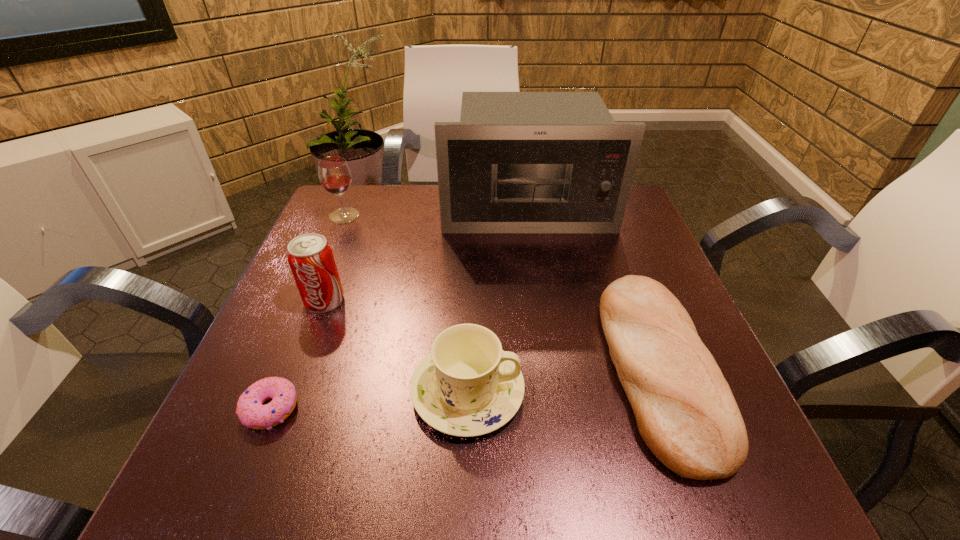
Locate an element on the screen. The width and height of the screenshot is (960, 540). the tallest object is located at coordinates (517, 162).

Locate an element on the screen. The image size is (960, 540). wineglass is located at coordinates point(334,173).

At what (x,y) coordinates should I click in order to perform the action: click on soda can. Please return your answer as a coordinate pair (x, y). Looking at the image, I should click on (310, 257).

Where is `chinaware`? chinaware is located at coordinates (467, 386).

Image resolution: width=960 pixels, height=540 pixels. In order to click on bread in this screenshot , I will do `click(685, 411)`.

At what (x,y) coordinates should I click in order to perform the action: click on doughnut. Please return your answer as a coordinate pair (x, y). Image resolution: width=960 pixels, height=540 pixels. Looking at the image, I should click on (250, 411).

Identify the location of vacant region located 0.050m on the front-facing side of the microwave oven. This screenshot has width=960, height=540. (533, 247).

Where is `free space located on the right of the wineglass`? This screenshot has width=960, height=540. free space located on the right of the wineglass is located at coordinates (484, 215).

Locate an element on the screen. This screenshot has width=960, height=540. vacant space situated 0.070m on the right of the soda can is located at coordinates (378, 301).

Where is `free location located on the handle side of the chinaware`? free location located on the handle side of the chinaware is located at coordinates (691, 391).